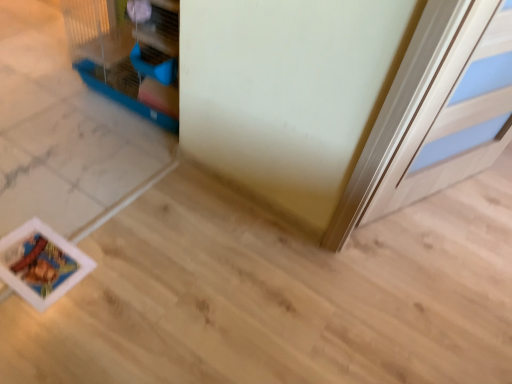
Describe the element at coordinates (128, 53) in the screenshot. I see `blue plastic bird cage at upper left` at that location.

Find the location of a particular element. blue plastic bird cage at upper left is located at coordinates (128, 53).

What is the approximate width of white glossy door at upper right?

white glossy door at upper right is 21.27 centimeters wide.

At what (x,y) coordinates should I click in order to perform the action: click on white glossy door at upper right. Please return your answer as a coordinate pair (x, y). This screenshot has height=384, width=512. Looking at the image, I should click on (456, 114).

This screenshot has width=512, height=384. Describe the element at coordinates (456, 114) in the screenshot. I see `white glossy door at upper right` at that location.

Image resolution: width=512 pixels, height=384 pixels. In order to click on blue plastic bird cage at upper left in this screenshot , I will do [x=128, y=53].

Is white glossy door at upper right to the left of blue plastic bird cage at upper left from the viewer's perspective?

No.

Based on the photo, is white glossy door at upper right in front of or behind blue plastic bird cage at upper left in the image?

Visually, white glossy door at upper right is located in front of blue plastic bird cage at upper left.

Does point (444, 134) come in front of point (135, 102)?

Yes, it is in front of point (135, 102).

From the image's perspective, which is below, white glossy door at upper right or blue plastic bird cage at upper left?

From the image's view, white glossy door at upper right is below.

From a real-world perspective, is white glossy door at upper right physically below blue plastic bird cage at upper left?

No, from a real-world perspective, white glossy door at upper right is not under blue plastic bird cage at upper left.

Can you confirm if white glossy door at upper right is wider than blue plastic bird cage at upper left?

Incorrect, the width of white glossy door at upper right does not surpass that of blue plastic bird cage at upper left.

Considering the sizes of objects white glossy door at upper right and blue plastic bird cage at upper left in the image provided, who is shorter, white glossy door at upper right or blue plastic bird cage at upper left?

blue plastic bird cage at upper left is shorter.

Is white glossy door at upper right bigger or smaller than blue plastic bird cage at upper left?

In the image, white glossy door at upper right appears to be smaller than blue plastic bird cage at upper left.

Is white glossy door at upper right not inside blue plastic bird cage at upper left?

That's correct, white glossy door at upper right is outside of blue plastic bird cage at upper left.

Would you say white glossy door at upper right is a long distance from blue plastic bird cage at upper left?

white glossy door at upper right is far away from blue plastic bird cage at upper left.

Is white glossy door at upper right positioned with its back to blue plastic bird cage at upper left?

Correct, white glossy door at upper right is looking away from blue plastic bird cage at upper left.

Can you tell me how much white glossy door at upper right and blue plastic bird cage at upper left differ in facing direction?

white glossy door at upper right and blue plastic bird cage at upper left are facing 64.8 degrees away from each other.

How distant is white glossy door at upper right from blue plastic bird cage at upper left?

3.52 feet.

This screenshot has width=512, height=384. Find the location of `bird cage below the white glossy door at upper right (from a real-world perspective)`. bird cage below the white glossy door at upper right (from a real-world perspective) is located at coordinates (x=128, y=53).

Which object is positioned more to the left, blue plastic bird cage at upper left or white glossy door at upper right?

blue plastic bird cage at upper left is more to the left.

Is the depth of blue plastic bird cage at upper left greater than that of white glossy door at upper right?

Yes.

Which is closer to the camera, (x=137, y=96) or (x=488, y=70)?

Point (x=137, y=96) is farther from the camera than point (x=488, y=70).

From the image's perspective, who appears lower, blue plastic bird cage at upper left or white glossy door at upper right?

white glossy door at upper right, from the image's perspective.

From a real-world perspective, between blue plastic bird cage at upper left and white glossy door at upper right, who is vertically lower?

A: blue plastic bird cage at upper left, from a real-world perspective.

Between blue plastic bird cage at upper left and white glossy door at upper right, which one has smaller width?

Thinner between the two is white glossy door at upper right.

Can you confirm if blue plastic bird cage at upper left is shorter than white glossy door at upper right?

Yes, blue plastic bird cage at upper left is shorter than white glossy door at upper right.

Considering the sizes of blue plastic bird cage at upper left and white glossy door at upper right in the image, is blue plastic bird cage at upper left bigger or smaller than white glossy door at upper right?

In the image, blue plastic bird cage at upper left appears to be larger than white glossy door at upper right.

Is blue plastic bird cage at upper left situated inside white glossy door at upper right or outside?

blue plastic bird cage at upper left lies outside white glossy door at upper right.

Would you say blue plastic bird cage at upper left is a long distance from white glossy door at upper right?

blue plastic bird cage at upper left is positioned a significant distance from white glossy door at upper right.

Is blue plastic bird cage at upper left turned away from white glossy door at upper right?

No.

How different are the orientations of blue plastic bird cage at upper left and white glossy door at upper right in degrees?

blue plastic bird cage at upper left and white glossy door at upper right are facing 64.8 degrees away from each other.

Identify the location of door located in front of the blue plastic bird cage at upper left. Image resolution: width=512 pixels, height=384 pixels. (456, 114).

Where is `door in front of the blue plastic bird cage at upper left`? door in front of the blue plastic bird cage at upper left is located at coordinates (456, 114).

The width and height of the screenshot is (512, 384). I want to click on door above the blue plastic bird cage at upper left (from a real-world perspective), so click(456, 114).